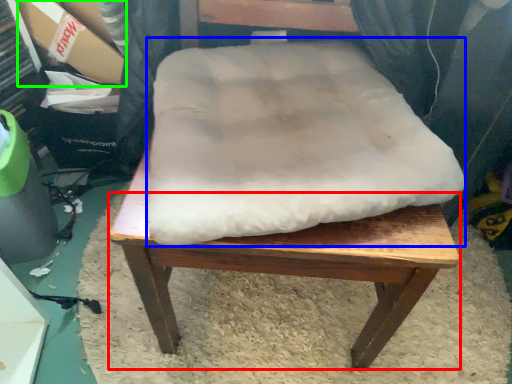
Question: Which object is the farthest from step stool (highlighted by a red box)? Choose among these: dog bed (highlighted by a blue box) or cardboard box (highlighted by a green box).

Choices:
 (A) dog bed
 (B) cardboard box

Answer: (B)